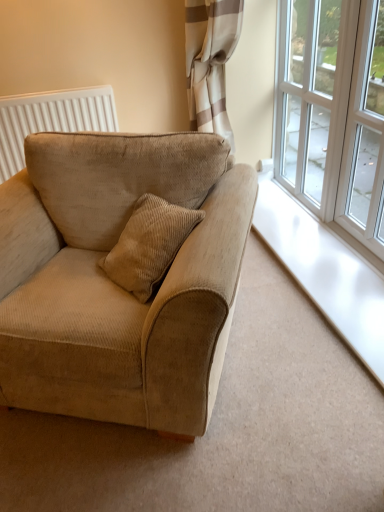
Question: Can you confirm if clear glass window at upper right, which is counted as the 2th window, starting from the back, is thinner than white glass window at upper right, which ranks as the 1th window in back-to-front order?

Choices:
 (A) yes
 (B) no

Answer: (B)

Question: From the image's perspective, does clear glass window at upper right, which is counted as the 2th window, starting from the back, appear higher than white glass window at upper right, which is the second window from front to back?

Choices:
 (A) no
 (B) yes

Answer: (A)

Question: Would you say clear glass window at upper right, which is the 1th window in front-to-back order, contains white glass window at upper right, which is the second window from front to back?

Choices:
 (A) yes
 (B) no

Answer: (B)

Question: Is clear glass window at upper right, which is counted as the 2th window, starting from the back, not close to white glass window at upper right, which ranks as the 1th window in back-to-front order?

Choices:
 (A) yes
 (B) no

Answer: (B)

Question: Considering the relative positions of clear glass window at upper right, which is counted as the 2th window, starting from the back, and white glass window at upper right, which is the second window from front to back, in the image provided, is clear glass window at upper right, which is counted as the 2th window, starting from the back, behind white glass window at upper right, which is the second window from front to back,?

Choices:
 (A) no
 (B) yes

Answer: (A)

Question: From the image's perspective, is clear glass window at upper right, which is counted as the 2th window, starting from the back, above or below white textured radiator at upper left?

Choices:
 (A) above
 (B) below

Answer: (B)

Question: Considering the positions of point (355, 45) and point (84, 110), is point (355, 45) closer or farther from the camera than point (84, 110)?

Choices:
 (A) closer
 (B) farther

Answer: (A)

Question: In terms of size, does clear glass window at upper right, which is counted as the 2th window, starting from the back, appear bigger or smaller than white textured radiator at upper left?

Choices:
 (A) small
 (B) big

Answer: (B)

Question: From a real-world perspective, relative to white textured radiator at upper left, is clear glass window at upper right, which is counted as the 2th window, starting from the back, vertically above or below?

Choices:
 (A) below
 (B) above

Answer: (B)

Question: Looking at their shapes, would you say white textured radiator at upper left is wider or thinner than beige corduroy couch at left?

Choices:
 (A) thin
 (B) wide

Answer: (A)

Question: Is white textured radiator at upper left situated inside beige corduroy couch at left or outside?

Choices:
 (A) outside
 (B) inside

Answer: (A)

Question: From their relative heights in the image, would you say white textured radiator at upper left is taller or shorter than beige corduroy couch at left?

Choices:
 (A) tall
 (B) short

Answer: (B)

Question: Based on their positions, is white textured radiator at upper left located to the left or right of beige corduroy couch at left?

Choices:
 (A) right
 (B) left

Answer: (B)

Question: From the image's perspective, is white textured radiator at upper left positioned above or below clear glass window at upper right, which is counted as the 2th window, starting from the back?

Choices:
 (A) below
 (B) above

Answer: (B)

Question: From their relative heights in the image, would you say white textured radiator at upper left is taller or shorter than clear glass window at upper right, which is the 1th window in front-to-back order?

Choices:
 (A) tall
 (B) short

Answer: (B)